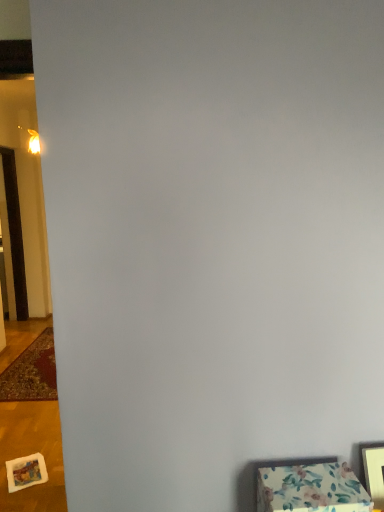
Question: Does carpeted mat at left have a lesser height compared to floral fabric ottoman at lower right?

Choices:
 (A) no
 (B) yes

Answer: (B)

Question: Considering the relative positions of carpeted mat at left and floral fabric ottoman at lower right in the image provided, is carpeted mat at left to the right of floral fabric ottoman at lower right from the viewer's perspective?

Choices:
 (A) no
 (B) yes

Answer: (A)

Question: Are carpeted mat at left and floral fabric ottoman at lower right located far from each other?

Choices:
 (A) no
 (B) yes

Answer: (B)

Question: Is carpeted mat at left bigger than floral fabric ottoman at lower right?

Choices:
 (A) yes
 (B) no

Answer: (A)

Question: Could floral fabric ottoman at lower right be considered to be inside carpeted mat at left?

Choices:
 (A) yes
 (B) no

Answer: (B)

Question: Is point (306, 471) positioned closer to the camera than point (16, 233)?

Choices:
 (A) farther
 (B) closer

Answer: (B)

Question: Is floral fabric ottoman at lower right inside or outside of brown wooden door at left?

Choices:
 (A) inside
 (B) outside

Answer: (B)

Question: Considering the positions of floral fabric ottoman at lower right and brown wooden door at left in the image, is floral fabric ottoman at lower right wider or thinner than brown wooden door at left?

Choices:
 (A) wide
 (B) thin

Answer: (A)

Question: In terms of height, does floral fabric ottoman at lower right look taller or shorter compared to brown wooden door at left?

Choices:
 (A) short
 (B) tall

Answer: (A)

Question: Is floral fabric ottoman at lower right wider or thinner than carpeted mat at left?

Choices:
 (A) thin
 (B) wide

Answer: (A)

Question: In terms of height, does floral fabric ottoman at lower right look taller or shorter compared to carpeted mat at left?

Choices:
 (A) tall
 (B) short

Answer: (A)

Question: Is floral fabric ottoman at lower right in front of or behind carpeted mat at left in the image?

Choices:
 (A) behind
 (B) front

Answer: (B)

Question: From a real-world perspective, is floral fabric ottoman at lower right physically located above or below carpeted mat at left?

Choices:
 (A) below
 (B) above

Answer: (B)

Question: Is brown wooden door at left taller or shorter than floral fabric ottoman at lower right?

Choices:
 (A) tall
 (B) short

Answer: (A)

Question: In the image, is brown wooden door at left positioned in front of or behind floral fabric ottoman at lower right?

Choices:
 (A) front
 (B) behind

Answer: (B)